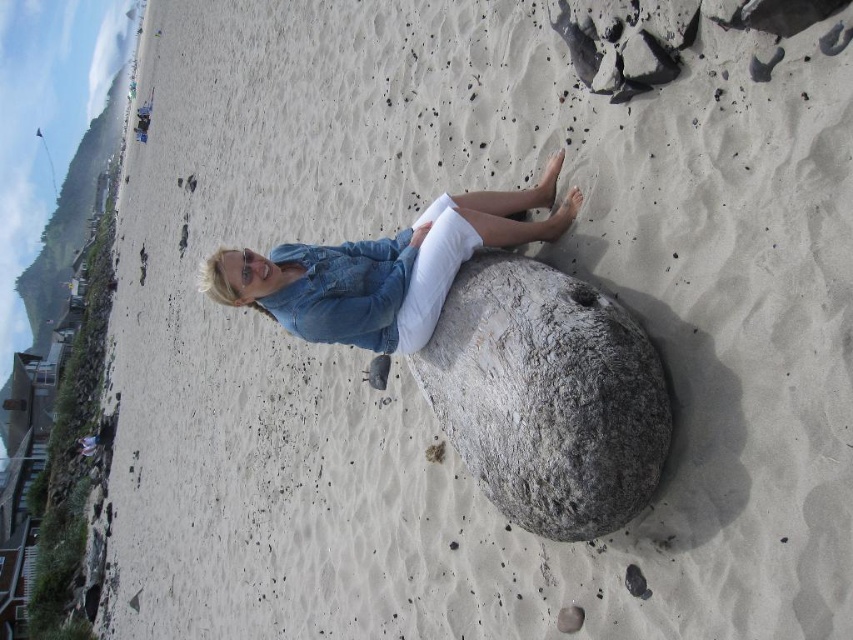
Question: Can you confirm if gray rough boulder at center is thinner than denim jacket at center?

Choices:
 (A) yes
 (B) no

Answer: (A)

Question: Observing the image, what is the correct spatial positioning of gray rough boulder at center in reference to denim jacket at center?

Choices:
 (A) right
 (B) left

Answer: (A)

Question: Can you confirm if gray rough boulder at center is positioned to the left of denim jacket at center?

Choices:
 (A) yes
 (B) no

Answer: (B)

Question: Among these objects, which one is nearest to the camera?

Choices:
 (A) gray rough boulder at center
 (B) denim jacket at center

Answer: (A)